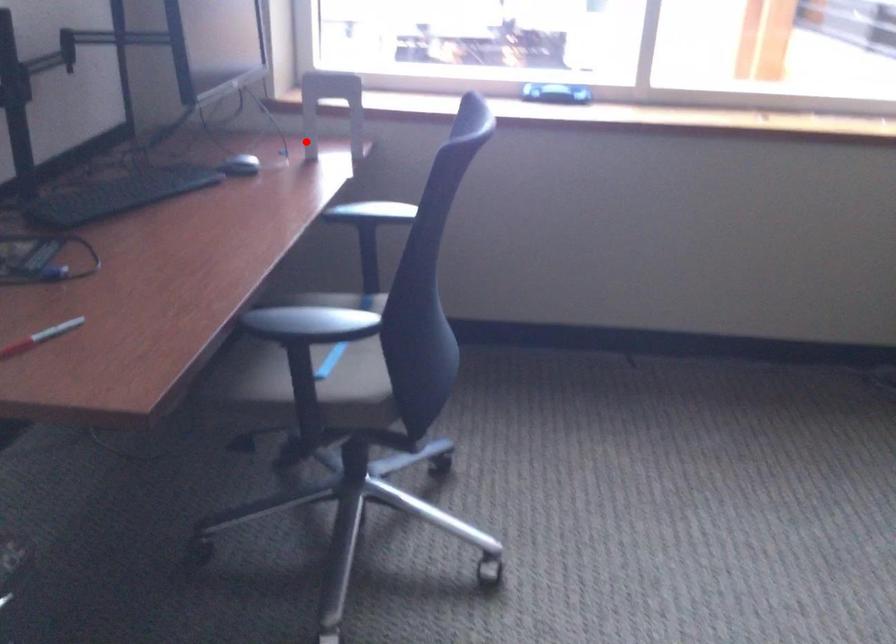
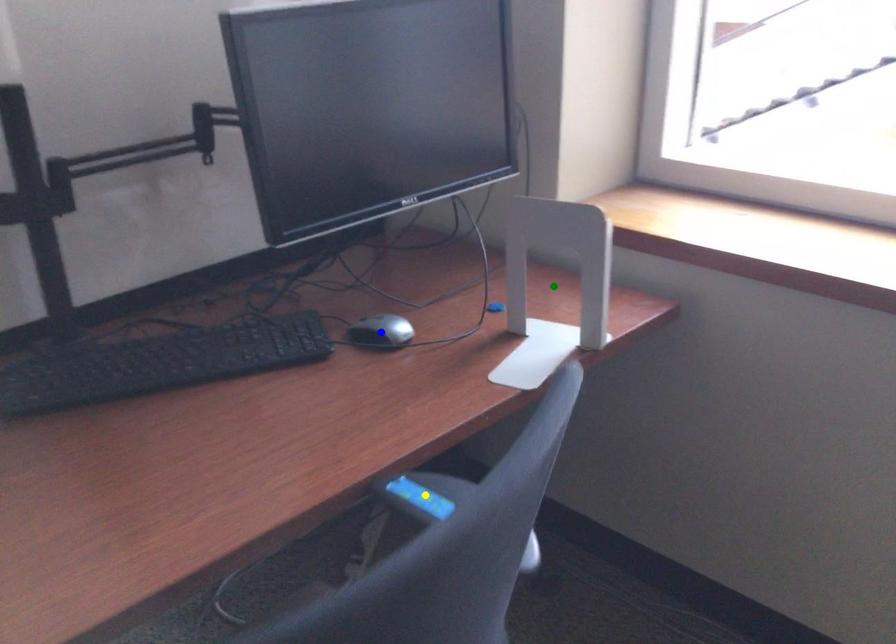
Question: I am providing you with two images of the same scene from different viewpoints. A red point is marked on the first image. You are given multiple points on the second image. Which spot in image 2 lines up with the point in image 1?

Choices:
 (A) yellow point
 (B) blue point
 (C) green point

Answer: (C)